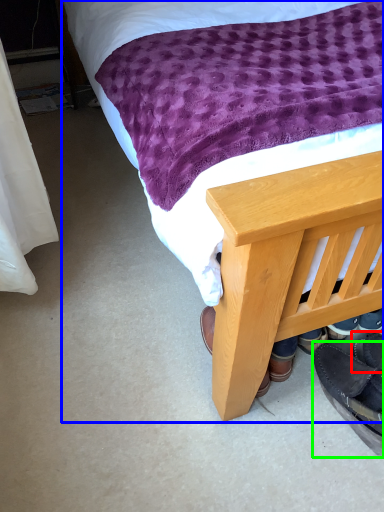
Question: Which object is positioned closest to footwear (highlighted by a red box)? Select from bed (highlighted by a blue box) and footwear (highlighted by a green box).

Choices:
 (A) bed
 (B) footwear

Answer: (B)